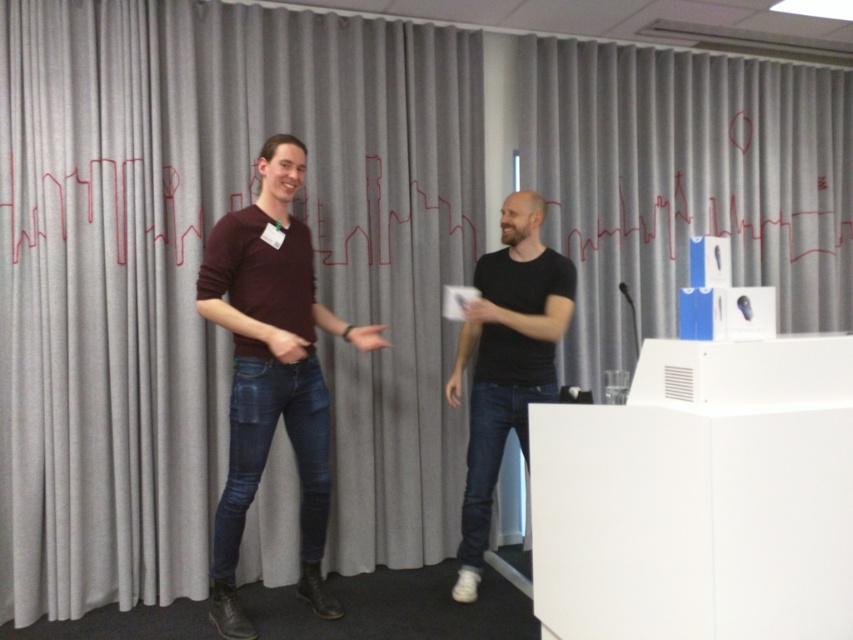
You are a delivery person who just arrived at the location shown in the image. You need to place a package that is 1 foot long between the gray fabric curtain at center and the white matte wii controller at center. Is there enough space between them to fit the package?

The gray fabric curtain at center and white matte wii controller at center are 37.92 inches apart from each other. Since 37.92 inches is approximately 3.16 feet, which is longer than the 1 foot length of the package, there is sufficient space to place the package between them.

Based on the photo, you are a photographer trying to capture a clear shot of the maroon sweater at center and the gray fabric curtain at upper center. Which object should you focus on first to ensure both are in focus?

You should focus on the maroon sweater at center first because it is closer to you than the gray fabric curtain at upper center, which is further away. By focusing on the closer object, the curtain in the background will naturally be in focus as well.